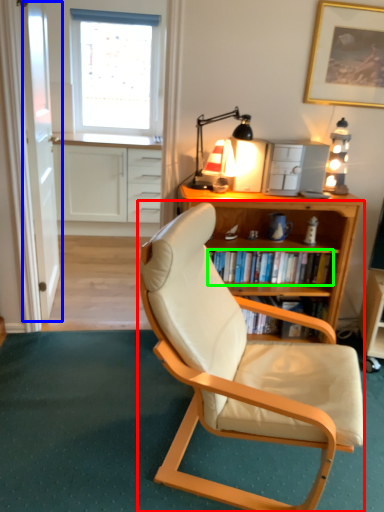
Question: Which is nearer to the chair (highlighted by a red box)? glass door (highlighted by a blue box) or shelf (highlighted by a green box).

Choices:
 (A) glass door
 (B) shelf

Answer: (B)